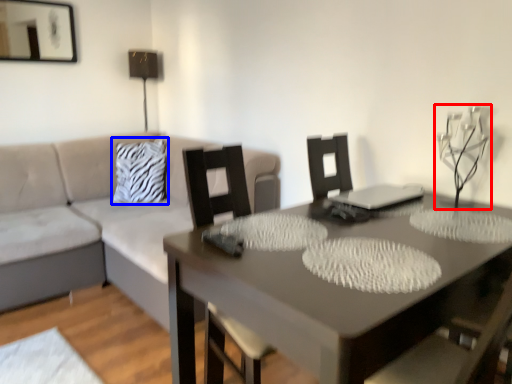
Question: Which object is closer to the camera taking this photo, candle holder (highlighted by a red box) or pillow (highlighted by a blue box)?

Choices:
 (A) candle holder
 (B) pillow

Answer: (A)